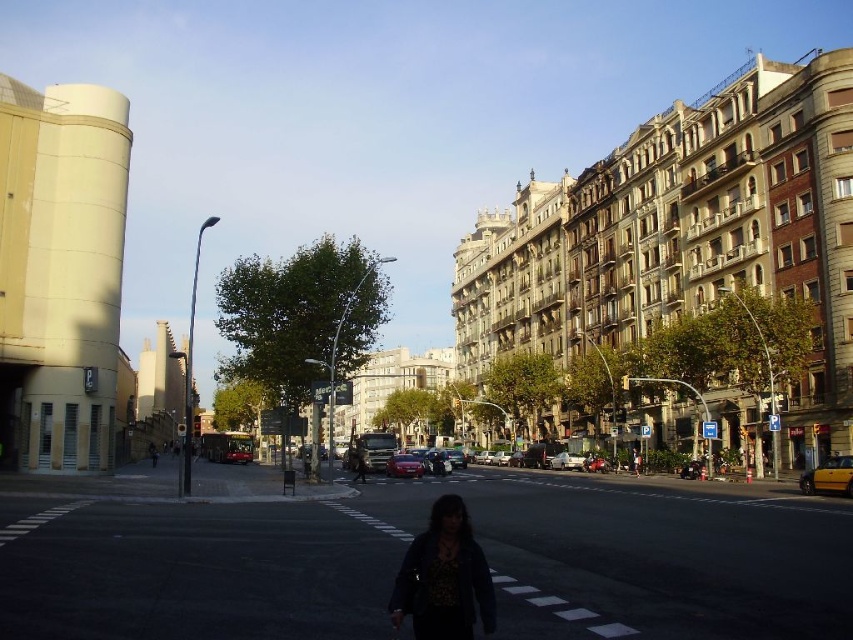
Does yellow matte taxi at lower right have a smaller size compared to metallic red car at center?

No, yellow matte taxi at lower right is not smaller than metallic red car at center.

Is point (848, 467) positioned after point (403, 468)?

No, (848, 467) is in front of (403, 468).

Where is `yellow matte taxi at lower right`? yellow matte taxi at lower right is located at coordinates (828, 476).

Does dark brown leather jacket at center appear over shiny red car at center?

Correct, dark brown leather jacket at center is located above shiny red car at center.

Who is lower down, dark brown leather jacket at center or shiny red car at center?

shiny red car at center

Find the location of a particular element. dark brown leather jacket at center is located at coordinates (358, 460).

Who is lower down, yellow matte taxi at lower right or shiny red car at center?

shiny red car at center

Who is positioned more to the left, yellow matte taxi at lower right or shiny red car at center?

shiny red car at center

Between point (804, 476) and point (229, 452), which one is positioned behind?

The point (229, 452) is more distant.

The height and width of the screenshot is (640, 853). Identify the location of yellow matte taxi at lower right. (828, 476).